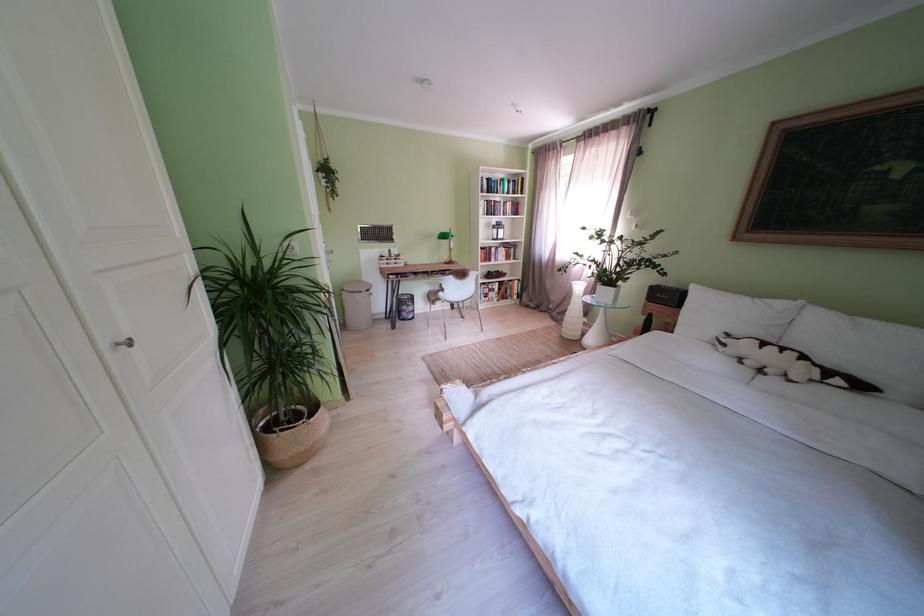
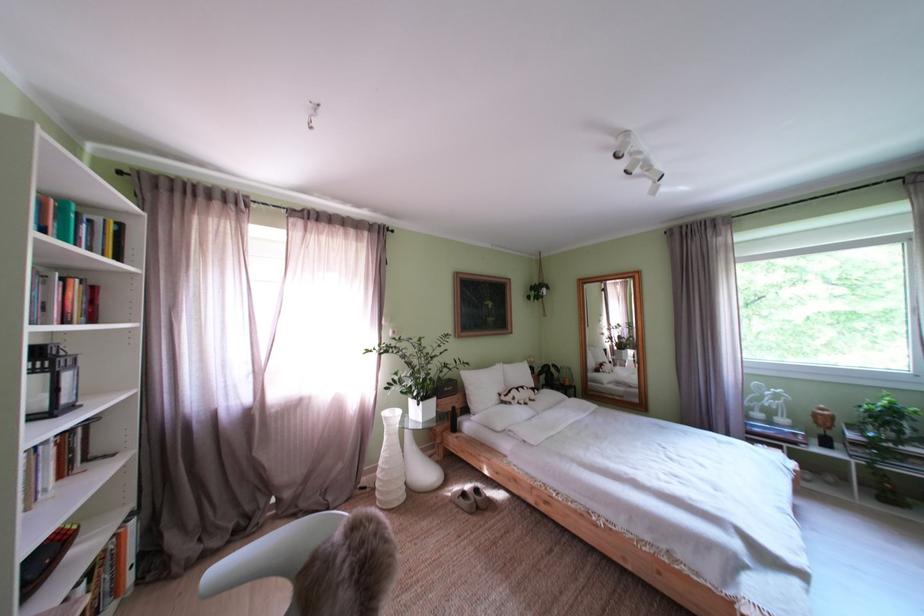
Find the pixel in the second image that matches the point at 804,382 in the first image.

(543, 403)